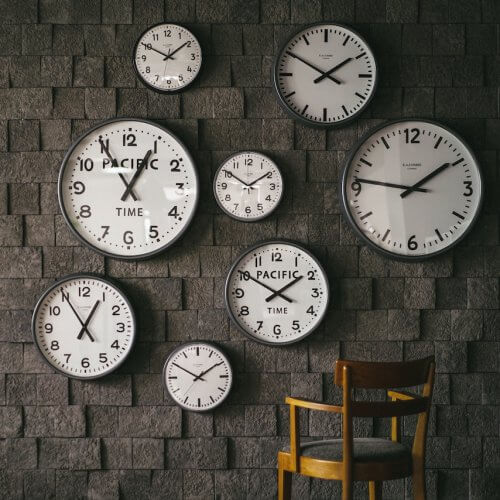
Identify the location of clocks. Image resolution: width=500 pixels, height=500 pixels. (172, 56), (314, 73), (150, 196), (254, 191), (410, 188), (284, 286), (206, 376), (94, 331).